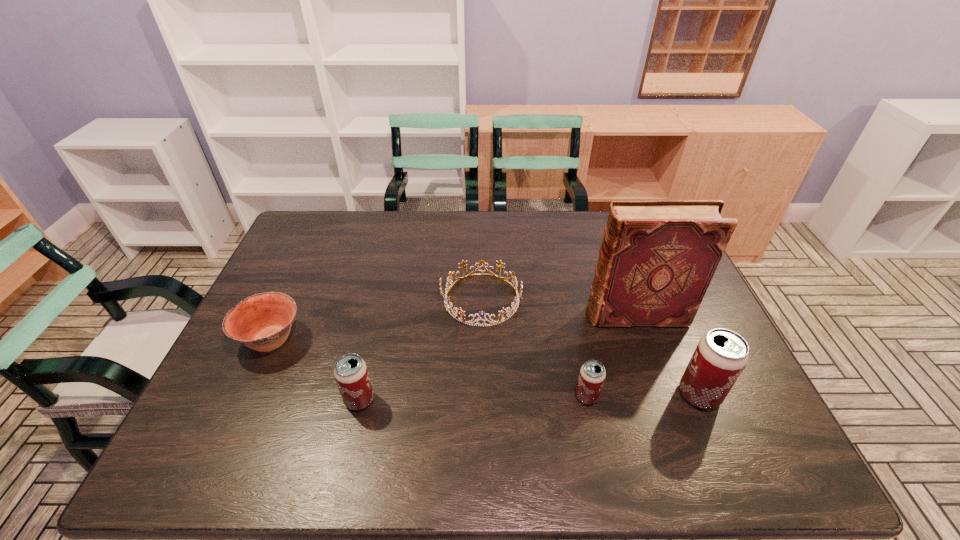
Where is `the second object from left to right`? the second object from left to right is located at coordinates (351, 374).

Image resolution: width=960 pixels, height=540 pixels. I want to click on the second shortest beer can, so click(x=351, y=374).

The width and height of the screenshot is (960, 540). Identify the location of the third object from right to left. (592, 374).

I want to click on the second beer can from right to left, so pos(592,374).

The width and height of the screenshot is (960, 540). I want to click on the fifth shortest object, so click(721, 355).

This screenshot has height=540, width=960. I want to click on the rightmost beer can, so click(x=721, y=355).

This screenshot has width=960, height=540. Identify the location of hardback book. (658, 257).

Locate an element on the screen. The width and height of the screenshot is (960, 540). the shortest object is located at coordinates (514, 306).

In order to click on the fourth object from right to left in this screenshot , I will do `click(514, 306)`.

Image resolution: width=960 pixels, height=540 pixels. I want to click on bowl, so click(x=262, y=322).